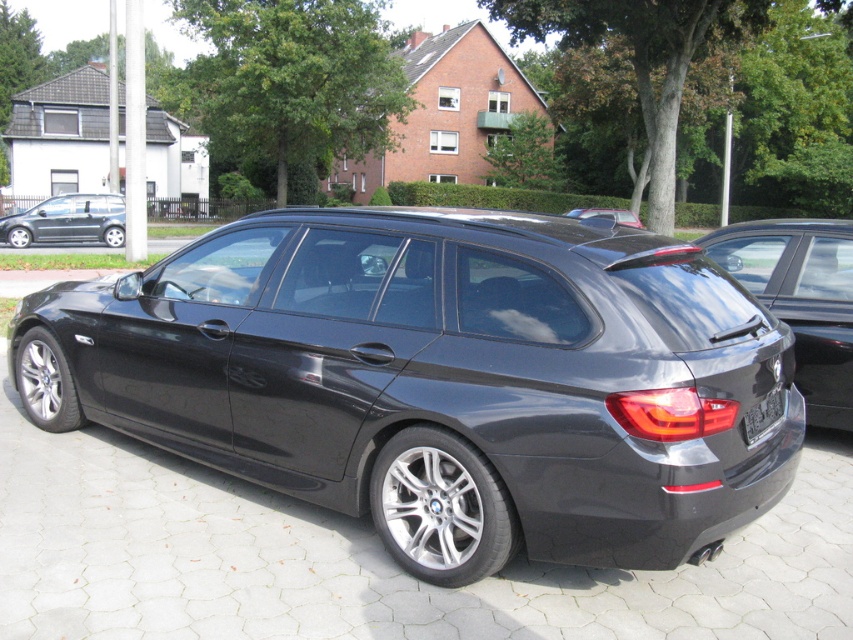
Is point (195, 422) closer to viewer compared to point (763, 408)?

That is False.

Is point (96, 332) behind point (767, 401)?

Yes, point (96, 332) is behind point (767, 401).

What are the coordinates of `satin black wagon at center` in the screenshot? It's located at (440, 380).

The image size is (853, 640). I want to click on satin black wagon at center, so click(440, 380).

Is point (219, 246) more distant than point (635, 224)?

That is False.

Does satin black wagon at center have a greater height compared to satin black car at center?

Incorrect, satin black wagon at center's height is not larger of satin black car at center's.

At what (x,y) coordinates should I click in order to perform the action: click on satin black wagon at center. Please return your answer as a coordinate pair (x, y). This screenshot has height=640, width=853. Looking at the image, I should click on (440, 380).

Find the location of `satin black wagon at center`. satin black wagon at center is located at coordinates (440, 380).

Does glossy black car at right have a smaller size compared to black plastic license plate at rear?

No.

I want to click on glossy black car at right, so click(x=799, y=298).

Which is behind, point (730, 240) or point (773, 416)?

The point (730, 240) is behind.

Image resolution: width=853 pixels, height=640 pixels. I want to click on glossy black car at right, so click(x=799, y=298).